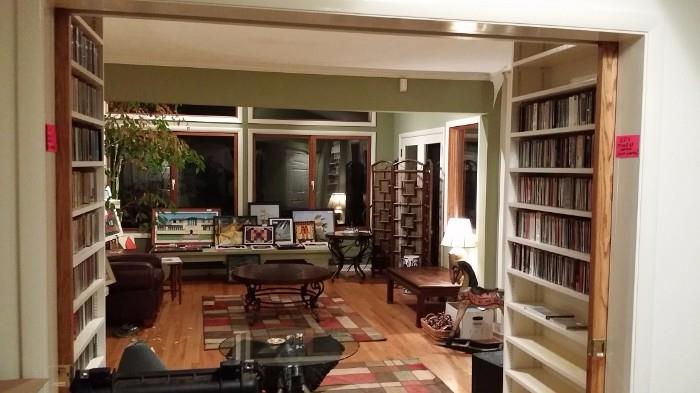
Where is `rocking horse`? The image size is (700, 393). rocking horse is located at coordinates (475, 297).